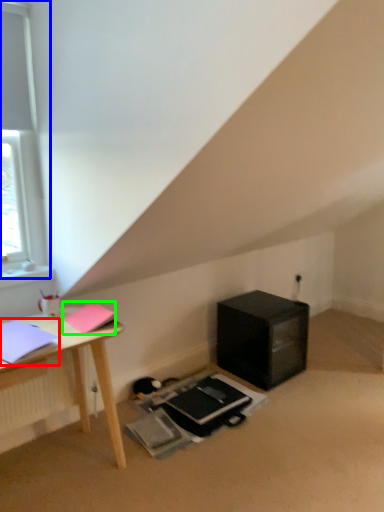
Question: Estimate the real-world distances between objects in this image. Which object is farther from notebook (highlighted by a red box), window (highlighted by a blue box) or notebook (highlighted by a green box)?

Choices:
 (A) window
 (B) notebook

Answer: (A)